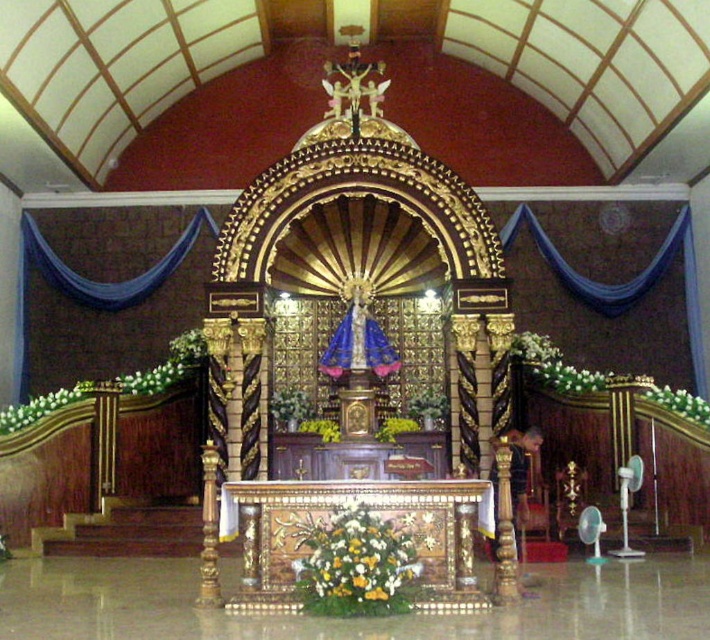
Question: Which point is farther to the camera?

Choices:
 (A) white floral arrangement at lower left
 (B) wooden altar at center

Answer: (A)

Question: Can you confirm if wooden altar at center is positioned to the left of green leafy plant at right?

Choices:
 (A) no
 (B) yes

Answer: (B)

Question: Can you confirm if wooden altar at center is positioned to the right of white floral arrangement at lower left?

Choices:
 (A) yes
 (B) no

Answer: (A)

Question: Estimate the real-world distances between objects in this image. Which object is closer to the white floral arrangement at right?

Choices:
 (A) wooden altar at center
 (B) white floral arrangement at lower left

Answer: (A)

Question: Is wooden altar at center thinner than green leafy plant at right?

Choices:
 (A) no
 (B) yes

Answer: (A)

Question: Among these points, which one is nearest to the camera?

Choices:
 (A) [x=355, y=515]
 (B) [x=383, y=488]

Answer: (A)